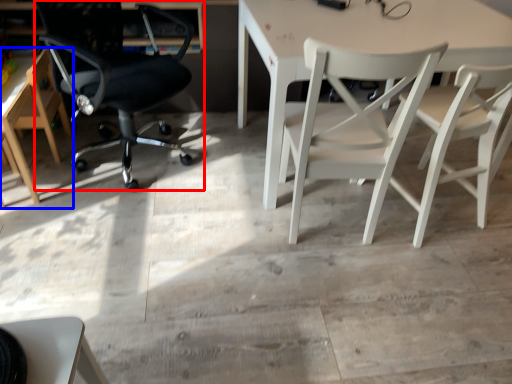
Question: Which point is closer to the camera, chair (highlighted by a red box) or chair (highlighted by a blue box)?

Choices:
 (A) chair
 (B) chair

Answer: (A)